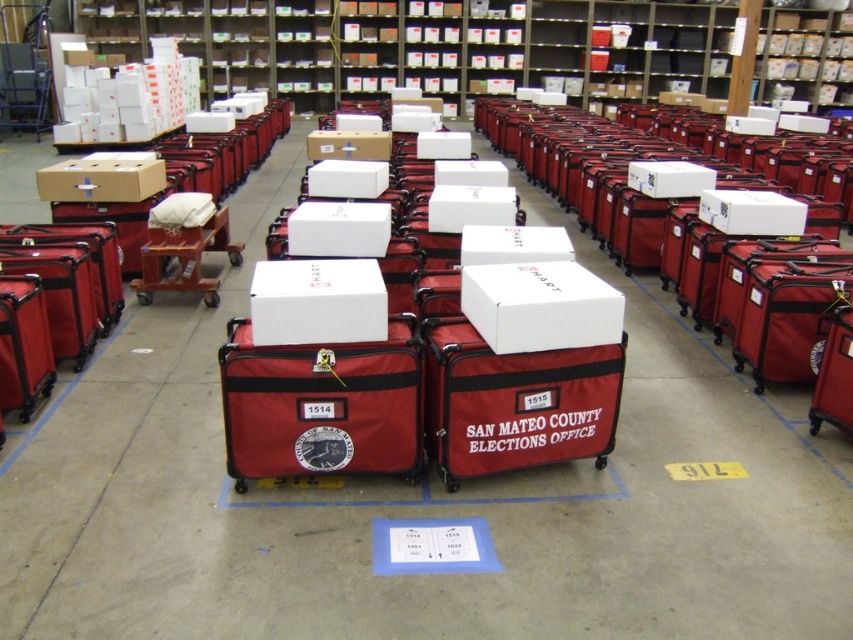
Question: Is matte red luggage at center bigger than white matte box at center?

Choices:
 (A) no
 (B) yes

Answer: (B)

Question: Can you confirm if matte cardboard box at upper left is positioned below matte cardboard box at center?

Choices:
 (A) yes
 (B) no

Answer: (A)

Question: Which point appears farthest from the camera in this image?

Choices:
 (A) (241, 483)
 (B) (631, 35)
 (C) (165, 262)
 (D) (389, 140)

Answer: (B)

Question: Which object is positioned farthest from the matte cardboard bookshelf at upper center?

Choices:
 (A) white matte box at center
 (B) matte white cart at center

Answer: (A)

Question: Is matte red luggage at center to the right of matte white cart at center from the viewer's perspective?

Choices:
 (A) yes
 (B) no

Answer: (A)

Question: Which point is closer to the camera taking this photo?

Choices:
 (A) click(434, 272)
 (B) click(387, 154)
 (C) click(180, 289)
 (D) click(341, 333)

Answer: (D)